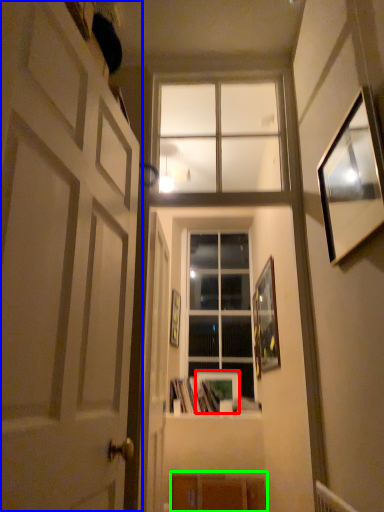
Question: Which object is the closest to the picture frame (highlighted by a red box)? Choose among these: door (highlighted by a blue box) or shelf (highlighted by a green box).

Choices:
 (A) door
 (B) shelf

Answer: (B)